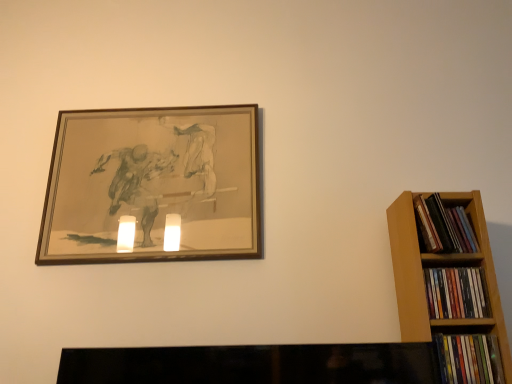
Question: Does multicolored paperbacks at right, the second book in the bottom-to-top sequence, have a larger size compared to wooden picture frame at upper left?

Choices:
 (A) yes
 (B) no

Answer: (B)

Question: Is multicolored paperbacks at right, arranged as the second book when viewed from the top, thinner than wooden picture frame at upper left?

Choices:
 (A) yes
 (B) no

Answer: (B)

Question: From the image's perspective, is multicolored paperbacks at right, arranged as the second book when viewed from the top, above wooden picture frame at upper left?

Choices:
 (A) yes
 (B) no

Answer: (B)

Question: Is multicolored paperbacks at right, the second book in the bottom-to-top sequence, in front of wooden picture frame at upper left?

Choices:
 (A) yes
 (B) no

Answer: (A)

Question: Is multicolored paperbacks at right, arranged as the second book when viewed from the top, next to wooden picture frame at upper left?

Choices:
 (A) yes
 (B) no

Answer: (B)

Question: From a real-world perspective, relative to multicolored plastic books at right, which is the third book in top-to-bottom order, is wooden picture frame at upper left vertically above or below?

Choices:
 (A) below
 (B) above

Answer: (B)

Question: Considering the positions of wooden picture frame at upper left and multicolored plastic books at right, placed as the 1th book when sorted from bottom to top, in the image, is wooden picture frame at upper left taller or shorter than multicolored plastic books at right, placed as the 1th book when sorted from bottom to top,?

Choices:
 (A) tall
 (B) short

Answer: (A)

Question: Looking at the image, does wooden picture frame at upper left seem bigger or smaller compared to multicolored plastic books at right, which is the third book in top-to-bottom order?

Choices:
 (A) big
 (B) small

Answer: (A)

Question: Is wooden picture frame at upper left inside the boundaries of multicolored plastic books at right, placed as the 1th book when sorted from bottom to top, or outside?

Choices:
 (A) inside
 (B) outside

Answer: (B)

Question: From their relative heights in the image, would you say multicolored paperbacks at right, the second book in the bottom-to-top sequence, is taller or shorter than multicolored paperbacks at right, the third book ordered from the bottom?

Choices:
 (A) tall
 (B) short

Answer: (B)

Question: Is multicolored paperbacks at right, the second book in the bottom-to-top sequence, in front of or behind multicolored paperbacks at right, the third book ordered from the bottom, in the image?

Choices:
 (A) front
 (B) behind

Answer: (A)

Question: From a real-world perspective, relative to multicolored paperbacks at right, the third book ordered from the bottom, is multicolored paperbacks at right, the second book in the bottom-to-top sequence, vertically above or below?

Choices:
 (A) below
 (B) above

Answer: (A)

Question: Is multicolored paperbacks at right, the second book in the bottom-to-top sequence, bigger or smaller than multicolored paperbacks at right, the third book ordered from the bottom?

Choices:
 (A) small
 (B) big

Answer: (B)

Question: From their relative heights in the image, would you say multicolored paperbacks at right, the third book ordered from the bottom, is taller or shorter than multicolored plastic books at right, placed as the 1th book when sorted from bottom to top?

Choices:
 (A) short
 (B) tall

Answer: (B)

Question: In the image, is multicolored paperbacks at right, placed as the first book when sorted from top to bottom, on the left side or the right side of multicolored plastic books at right, which is the third book in top-to-bottom order?

Choices:
 (A) left
 (B) right

Answer: (B)